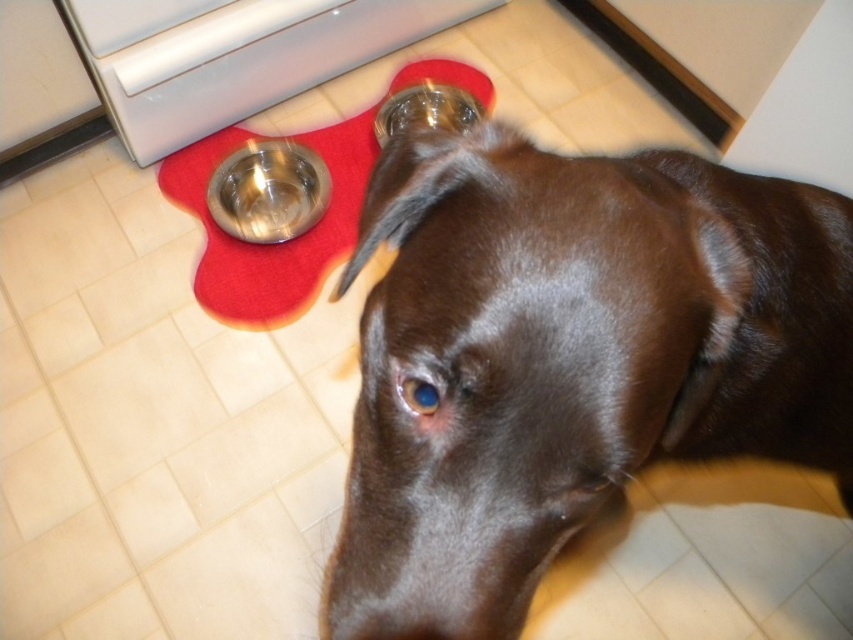
Can you confirm if shiny brown fur at center is shorter than red felt mat at center?

Correct, shiny brown fur at center is not as tall as red felt mat at center.

Between point (370, 348) and point (367, 160), which one is positioned in front?

Point (370, 348)

The width and height of the screenshot is (853, 640). What do you see at coordinates (567, 358) in the screenshot?
I see `shiny brown fur at center` at bounding box center [567, 358].

You are a GUI agent. You are given a task and a screenshot of the screen. Output one action in this format:
    pyautogui.click(x=<x>, y=<y>)
    Task: Click on the shiny brown fur at center
    This screenshot has width=853, height=640.
    Given the screenshot: What is the action you would take?
    (x=567, y=358)

Is point (587, 346) positioned before point (103, 92)?

That is True.

Between point (497, 481) and point (292, 0), which one is positioned behind?

Positioned behind is point (292, 0).

This screenshot has height=640, width=853. Identify the location of shiny brown fur at center. (567, 358).

Does point (384, 51) lie behind point (332, 188)?

Yes, point (384, 51) is farther from viewer.

Which of these two, white glossy oven at upper left or red felt mat at center, stands shorter?

Standing shorter between the two is white glossy oven at upper left.

Where is `white glossy oven at upper left`? The image size is (853, 640). white glossy oven at upper left is located at coordinates (234, 54).

Where is `white glossy oven at upper left`? This screenshot has width=853, height=640. white glossy oven at upper left is located at coordinates click(234, 54).